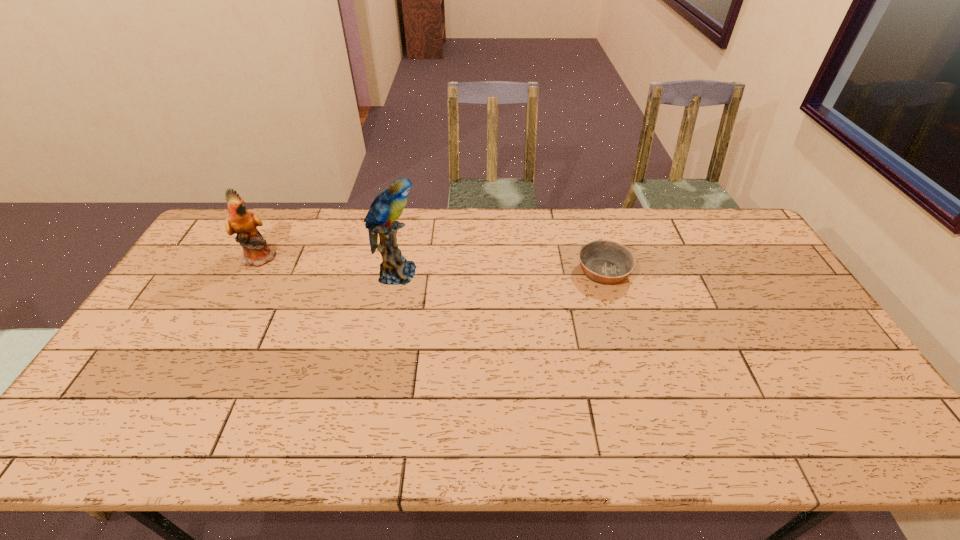
This screenshot has width=960, height=540. I want to click on vacant space that's between the second object from left to right and the rightmost object, so click(500, 273).

Locate an element on the screen. The height and width of the screenshot is (540, 960). free space between the tallest object and the rightmost object is located at coordinates (500, 273).

In order to click on vacant space in between the rightmost object and the leftmost object in this screenshot , I will do `click(432, 265)`.

I want to click on vacant area that lies between the second shortest object and the bowl, so click(x=432, y=265).

Locate an element on the screen. This screenshot has width=960, height=540. unoccupied position between the bowl and the right parrot is located at coordinates click(x=500, y=273).

Find the location of a particular element. This screenshot has height=540, width=960. object that stands as the second closest to the left parrot is located at coordinates (605, 262).

Identify which object is the second closest to the shortest object. Please provide its 2D coordinates. Your answer should be formatted as a tuple, i.e. [(x, y)], where the tuple contains the x and y coordinates of a point satisfying the conditions above.

[(256, 252)]

Find the location of a particular element. The image size is (960, 540). blank space that satisfies the following two spatial constraints: 1. on the front-facing side of the left parrot; 2. on the back side of the rightmost object is located at coordinates (253, 272).

You are a GUI agent. You are given a task and a screenshot of the screen. Output one action in this format:
    pyautogui.click(x=<x>, y=<y>)
    Task: Click on the free region that satisfies the following two spatial constraints: 1. on the front-facing side of the left parrot; 2. on the back side of the rightmost object
    This screenshot has height=540, width=960.
    Given the screenshot: What is the action you would take?
    pyautogui.click(x=253, y=272)

Image resolution: width=960 pixels, height=540 pixels. Find the location of `blank space that satisfies the following two spatial constraints: 1. on the front-facing side of the left parrot; 2. on the right side of the rightmost object`. blank space that satisfies the following two spatial constraints: 1. on the front-facing side of the left parrot; 2. on the right side of the rightmost object is located at coordinates (253, 272).